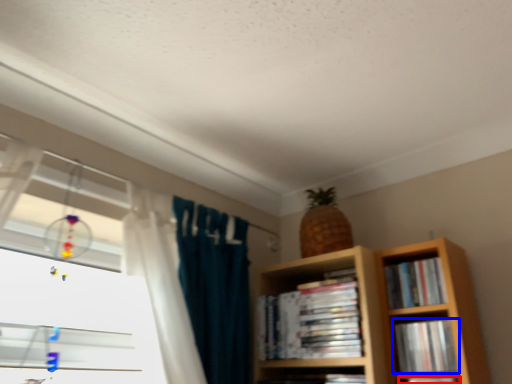
Question: Which point is closer to the camera, book (highlighted by a red box) or book (highlighted by a blue box)?

Choices:
 (A) book
 (B) book

Answer: (A)